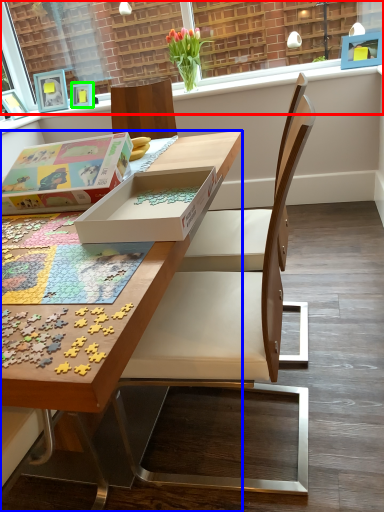
Question: Which object is the closest to the window frame (highlighted by a red box)? Choose among these: desk (highlighted by a blue box) or picture frame (highlighted by a green box).

Choices:
 (A) desk
 (B) picture frame

Answer: (B)